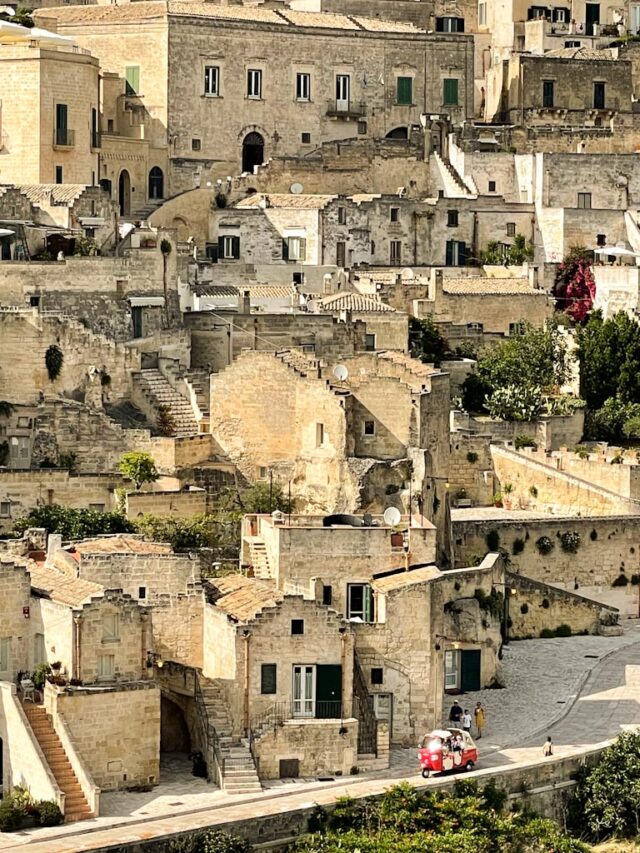
Find the location of a particular element. green windows is located at coordinates (402, 91), (452, 95).